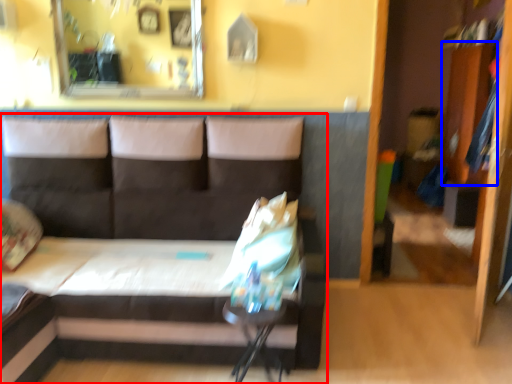
Question: Which object is further to the camera taking this photo, studio couch (highlighted by a red box) or dresser (highlighted by a blue box)?

Choices:
 (A) studio couch
 (B) dresser

Answer: (B)